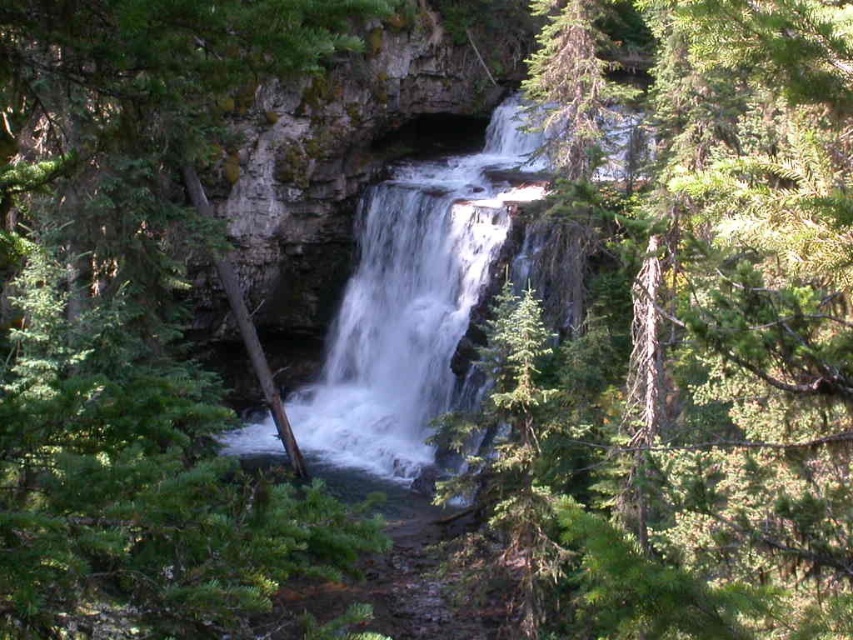
Question: Which point is closer to the camera?

Choices:
 (A) (810, 476)
 (B) (140, 461)
 (C) (401, 298)

Answer: (B)

Question: Is green textured tree at center above white frothy water at center?

Choices:
 (A) yes
 (B) no

Answer: (B)

Question: Which object is positioned closest to the green leafy tree at center?

Choices:
 (A) white frothy water at center
 (B) green textured tree at center

Answer: (B)

Question: Is green textured tree at center above white frothy water at center?

Choices:
 (A) yes
 (B) no

Answer: (B)

Question: Does green leafy tree at center have a greater width compared to white frothy water at center?

Choices:
 (A) no
 (B) yes

Answer: (A)

Question: Which point is closer to the camera?

Choices:
 (A) green leafy tree at center
 (B) white frothy water at center
 (C) green textured tree at center

Answer: (C)